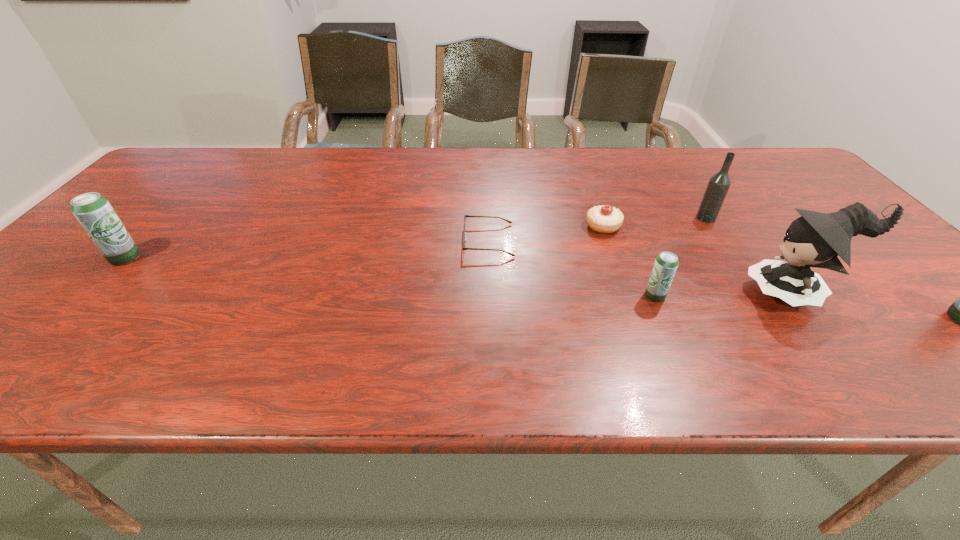
This screenshot has width=960, height=540. I want to click on object that is at the left edge, so pos(93,211).

In order to click on free spot at the far edge of the desktop in this screenshot , I will do `click(407, 178)`.

Image resolution: width=960 pixels, height=540 pixels. Identify the location of vacant area at the near edge of the desktop. (758, 340).

In the image, there is a desktop. At what (x,y) coordinates should I click in order to perform the action: click on vacant space at the far left corner. Please return your answer as a coordinate pair (x, y). Looking at the image, I should click on coord(196,171).

At what (x,y) coordinates should I click in order to perform the action: click on vacant area that lies between the second shortest object and the second beer can from left to right. Please return your answer as a coordinate pair (x, y). The height and width of the screenshot is (540, 960). Looking at the image, I should click on (629, 261).

Find the location of `free space between the doll and the farthest beer can`. free space between the doll and the farthest beer can is located at coordinates (460, 275).

Locate which object ranks sixth in proximity to the rightmost beer can. Please provide its 2D coordinates. Your answer should be formatted as a tuple, i.e. [(x, y)], where the tuple contains the x and y coordinates of a point satisfying the conditions above.

[(93, 211)]

The height and width of the screenshot is (540, 960). In order to click on object identified as the sixth closest to the tallest object in this screenshot , I will do `click(93, 211)`.

Where is `beer can that stands as the third closest to the vodka`? The image size is (960, 540). beer can that stands as the third closest to the vodka is located at coordinates [x=93, y=211].

Select which beer can is the second closest to the second farthest beer can. Please provide its 2D coordinates. Your answer should be formatted as a tuple, i.e. [(x, y)], where the tuple contains the x and y coordinates of a point satisfying the conditions above.

[(93, 211)]